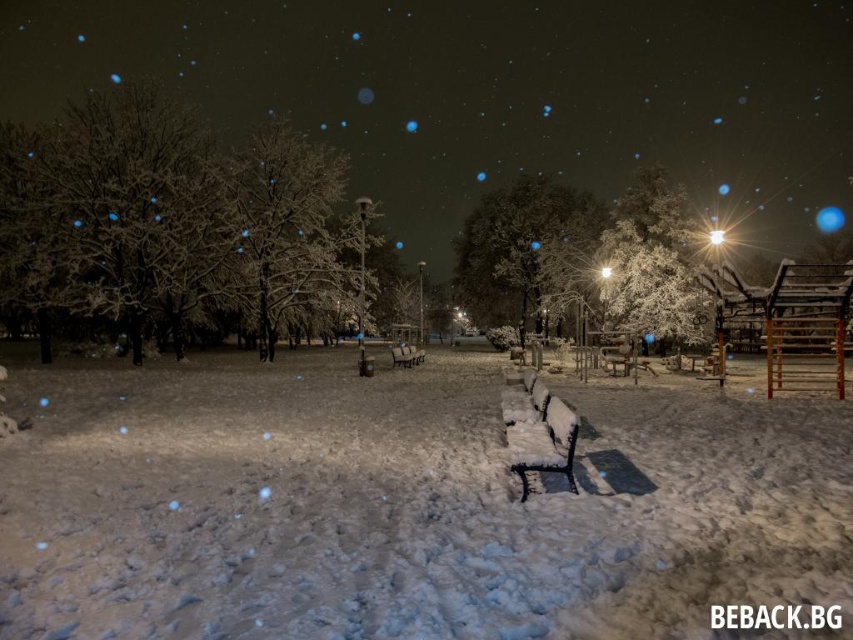
Between point (48, 170) and point (488, 250), which one is positioned behind?

Positioned behind is point (488, 250).

Between snow-covered tree at left and snow-covered tree at center, which one has less height?

With less height is snow-covered tree at center.

Between point (329, 240) and point (460, 269), which one is positioned behind?

Point (460, 269)

This screenshot has width=853, height=640. I want to click on snow-covered tree at left, so click(x=167, y=218).

Who is positioned more to the left, snow-covered tree at center or white frosty tree at right?

Positioned to the left is snow-covered tree at center.

The width and height of the screenshot is (853, 640). What are the coordinates of `snow-covered tree at center` in the screenshot? It's located at (521, 246).

Does snow-covered metal bench at center appear over wooden bench at center?

No.

Who is more forward, (x=523, y=406) or (x=415, y=355)?

Point (x=523, y=406)

The image size is (853, 640). In order to click on snow-covered metal bench at center in this screenshot , I will do `click(538, 432)`.